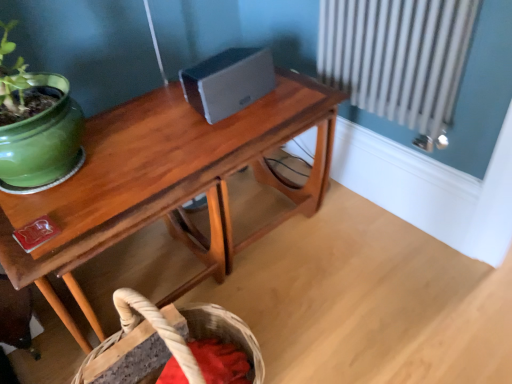
Measure the distance between point (x=196, y=342) and camera.

Point (x=196, y=342) is 1.04 meters away from camera.

Describe the element at coordinates (173, 346) in the screenshot. I see `woven natural fiber basket at lower center` at that location.

Where is `woven natural fiber basket at lower center`? This screenshot has height=384, width=512. woven natural fiber basket at lower center is located at coordinates (173, 346).

What is the approximate height of wooden table at center?

wooden table at center is 20.45 inches tall.

The height and width of the screenshot is (384, 512). Identify the location of wooden table at center. (166, 184).

The image size is (512, 384). Describe the element at coordinates (166, 184) in the screenshot. I see `wooden table at center` at that location.

This screenshot has width=512, height=384. What are the coordinates of `woven natural fiber basket at lower center` in the screenshot? It's located at (173, 346).

Considering the relative positions of wooden table at center and woven natural fiber basket at lower center in the image provided, is wooden table at center to the left or to the right of woven natural fiber basket at lower center?

wooden table at center is to the right of woven natural fiber basket at lower center.

Is the depth of wooden table at center greater than that of woven natural fiber basket at lower center?

No, the depth of wooden table at center is less than that of woven natural fiber basket at lower center.

Which is nearer, (133, 158) or (114, 342)?

The point (114, 342) is more forward.

From the image's perspective, would you say wooden table at center is positioned over woven natural fiber basket at lower center?

Correct, wooden table at center appears higher than woven natural fiber basket at lower center in the image.

Consider the image. From a real-world perspective, between wooden table at center and woven natural fiber basket at lower center, who is vertically higher?

wooden table at center.

Which of these two, wooden table at center or woven natural fiber basket at lower center, is wider?

With larger width is wooden table at center.

Considering the relative sizes of wooden table at center and woven natural fiber basket at lower center in the image provided, is wooden table at center shorter than woven natural fiber basket at lower center?

In fact, wooden table at center may be taller than woven natural fiber basket at lower center.

Which of these two, wooden table at center or woven natural fiber basket at lower center, is smaller?

With smaller size is woven natural fiber basket at lower center.

Is woven natural fiber basket at lower center inside wooden table at center?

No, woven natural fiber basket at lower center is located outside of wooden table at center.

Are wooden table at center and woven natural fiber basket at lower center beside each other?

No, wooden table at center is not making contact with woven natural fiber basket at lower center.

Is wooden table at center aimed at woven natural fiber basket at lower center?

Yes, wooden table at center is facing woven natural fiber basket at lower center.

What's the angular difference between wooden table at center and woven natural fiber basket at lower center's facing directions?

They differ by 0.652 degrees in their facing directions.

Locate an element on the screen. The width and height of the screenshot is (512, 384). basket below the wooden table at center (from the image's perspective) is located at coordinates (173, 346).

Visually, is woven natural fiber basket at lower center positioned to the left or to the right of wooden table at center?

woven natural fiber basket at lower center is to the left of wooden table at center.

Is woven natural fiber basket at lower center positioned behind wooden table at center?

Yes, the depth of woven natural fiber basket at lower center is greater than that of wooden table at center.

Is point (188, 321) closer to viewer compared to point (126, 130)?

That is True.

From the image's perspective, between woven natural fiber basket at lower center and wooden table at center, which one is located above?

wooden table at center.

From a real-world perspective, between woven natural fiber basket at lower center and wooden table at center, who is vertically higher?

In real-world perspective, wooden table at center is above.

Can you confirm if woven natural fiber basket at lower center is thinner than wooden table at center?

Correct, the width of woven natural fiber basket at lower center is less than that of wooden table at center.

Considering the relative sizes of woven natural fiber basket at lower center and wooden table at center in the image provided, is woven natural fiber basket at lower center shorter than wooden table at center?

Yes.

Who is smaller, woven natural fiber basket at lower center or wooden table at center?

woven natural fiber basket at lower center.

Can we say woven natural fiber basket at lower center lies outside wooden table at center?

Indeed, woven natural fiber basket at lower center is completely outside wooden table at center.

Is woven natural fiber basket at lower center not near wooden table at center?

No, woven natural fiber basket at lower center is not far from wooden table at center.

Could you tell me if woven natural fiber basket at lower center is turned towards wooden table at center?

No.

Where is `basket that appears below the wooden table at center (from the image's perspective)`? Image resolution: width=512 pixels, height=384 pixels. basket that appears below the wooden table at center (from the image's perspective) is located at coordinates (173, 346).

Identify the location of table that is in front of the woven natural fiber basket at lower center. The image size is (512, 384). (166, 184).

You are a GUI agent. You are given a task and a screenshot of the screen. Output one action in this format:
    pyautogui.click(x=<x>, y=<y>)
    Task: Click on the basket below the wooden table at center (from a real-world perspective)
    
    Given the screenshot: What is the action you would take?
    pyautogui.click(x=173, y=346)